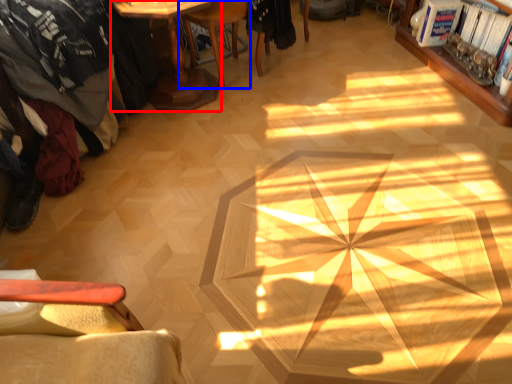
Question: Which object appears farthest to the camera in this image, table (highlighted by a red box) or chair (highlighted by a blue box)?

Choices:
 (A) table
 (B) chair

Answer: (B)